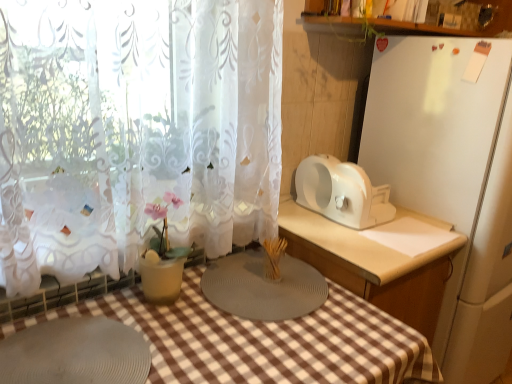
Question: From the image's perspective, is gray rubber placemat at center, which is the first appliance in left-to-right order, over white plastic toaster at right, the second appliance when ordered from right to left?

Choices:
 (A) no
 (B) yes

Answer: (A)

Question: Is gray rubber placemat at center, which is the first appliance in left-to-right order, bigger than white plastic toaster at right, the second appliance when ordered from right to left?

Choices:
 (A) no
 (B) yes

Answer: (A)

Question: Is the depth of gray rubber placemat at center, placed as the third appliance when sorted from right to left, greater than that of white plastic toaster at right, the second appliance when ordered from right to left?

Choices:
 (A) yes
 (B) no

Answer: (B)

Question: Does gray rubber placemat at center, which is the first appliance in left-to-right order, have a greater height compared to white plastic toaster at right, positioned as the 2th appliance in left-to-right order?

Choices:
 (A) no
 (B) yes

Answer: (A)

Question: Is gray rubber placemat at center, which is the first appliance in left-to-right order, located outside white plastic toaster at right, positioned as the 2th appliance in left-to-right order?

Choices:
 (A) yes
 (B) no

Answer: (A)

Question: Considering the relative sizes of gray rubber placemat at center, placed as the third appliance when sorted from right to left, and white plastic toaster at right, positioned as the 2th appliance in left-to-right order, in the image provided, is gray rubber placemat at center, placed as the third appliance when sorted from right to left, wider than white plastic toaster at right, positioned as the 2th appliance in left-to-right order,?

Choices:
 (A) yes
 (B) no

Answer: (A)

Question: From the image's perspective, would you say gray rubber placemat at center, which is the first appliance in left-to-right order, is positioned over gray rubber mat at lower left?

Choices:
 (A) no
 (B) yes

Answer: (B)

Question: Does gray rubber placemat at center, which is the first appliance in left-to-right order, contain gray rubber mat at lower left?

Choices:
 (A) no
 (B) yes

Answer: (A)

Question: Is gray rubber placemat at center, which is the first appliance in left-to-right order, behind gray rubber mat at lower left?

Choices:
 (A) yes
 (B) no

Answer: (A)

Question: Is gray rubber placemat at center, which is the first appliance in left-to-right order, taller than gray rubber mat at lower left?

Choices:
 (A) yes
 (B) no

Answer: (A)

Question: From a real-world perspective, is gray rubber placemat at center, which is the first appliance in left-to-right order, beneath gray rubber mat at lower left?

Choices:
 (A) yes
 (B) no

Answer: (B)

Question: Is gray rubber placemat at center, which is the first appliance in left-to-right order, placed right next to gray rubber mat at lower left?

Choices:
 (A) no
 (B) yes

Answer: (A)

Question: Is gray rubber mat at lower left positioned behind gray rubber placemat at center, placed as the third appliance when sorted from right to left?

Choices:
 (A) yes
 (B) no

Answer: (B)